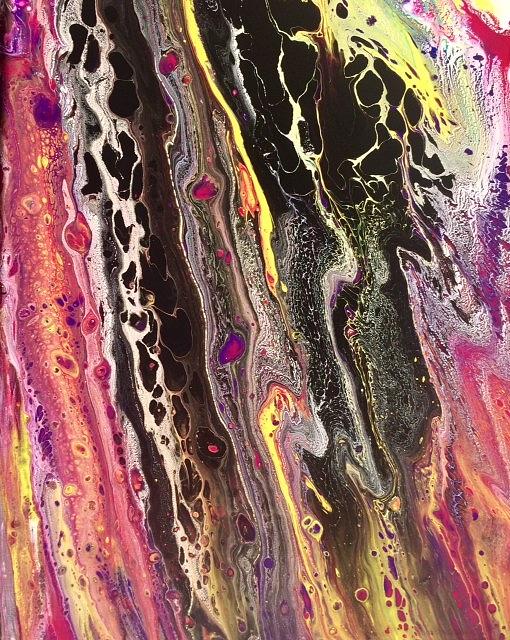
Where is `abstract painting`? abstract painting is located at coordinates (214, 166).